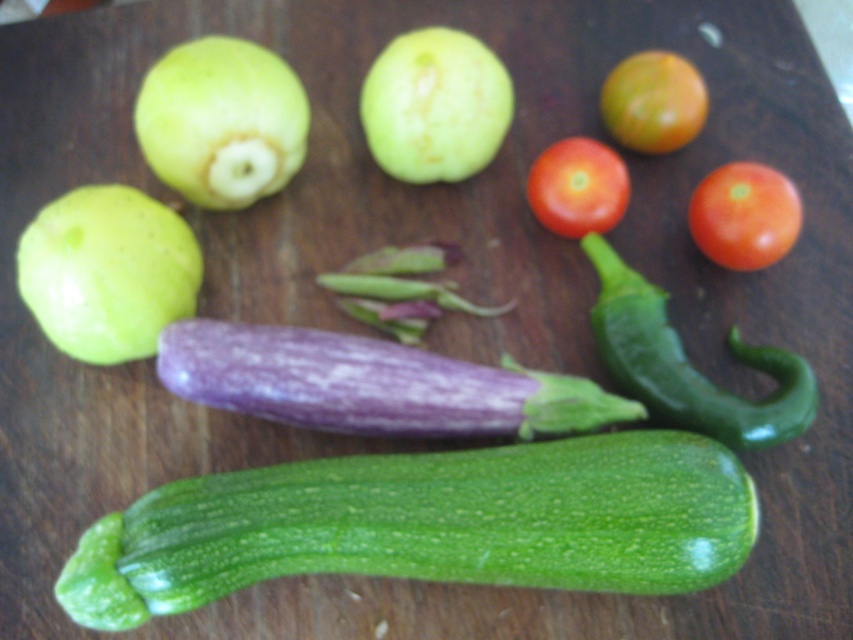
You are a chef preparing a dish and need to place the green glossy chili pepper at center right and the shiny red tomato at right on a plate. The plate has a diameter of 10 inches. If you want to place them side by side without overlapping, will they fit?

The distance between the green glossy chili pepper at center right and the shiny red tomato at right is 5.77 inches. Since the plate is 10 inches in diameter, there is enough space to place them side by side without overlapping as 5.77 inches is less than half of the plate diameter.

Based on the photo, you are preparing a picnic basket and want to fit both the purple matte eggplant at center and the green matte apple at upper center. Which item should you place first to ensure both fit in the basket?

The purple matte eggplant at center occupies less space than the green matte apple at upper center, so you should place the larger green matte apple at upper center first to ensure both fit in the basket.

You are preparing to pack these fruits and vegetables into a basket. The basket has a width limit of 10 cm. If the purple matte eggplant at center is 12 cm wide and the green matte apple at upper center is 8 cm wide, will both fit side by side in the basket?

The purple matte eggplant at center is 12 cm wide and the green matte apple at upper center is 8 cm wide. Combined, their widths total 20 cm, which exceeds the basket width limit of 10 cm. Therefore, they cannot fit side by side in the basket.